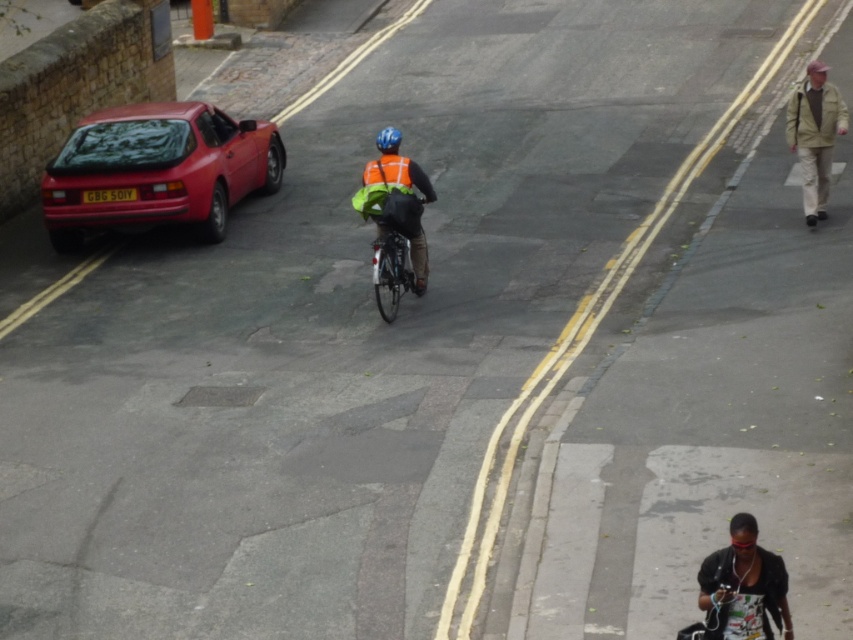
You are a delivery drone flying above the street scene. You need to land safely near the shiny red car at left without disturbing the cyclist. Based on their positions, can you determine if the landing zone is clear?

The shiny red car at left is located at point (155, 170), so the landing zone near the shiny red car at left should be clear as long as the drone avoids the cyclist who is riding away from the camera towards the right side of the frame.

You are a pedestrian standing on the bridge and see the reflective orange vest at center and the blue matte helmet at center. Which object is taller?

The reflective orange vest at center is taller than the blue matte helmet at center.

You are a pedestrian standing on the sidewalk and want to cross the road to reach the green reflective fabric bicycle at center. The shiny red car at left is blocking your path. Which direction should you move to go around the car and reach the bicycle?

You should move to the right side of the shiny red car at left because the shiny red car at left is to the left of green reflective fabric bicycle at center, so going around to the right would allow you to reach the bicycle without obstruction.